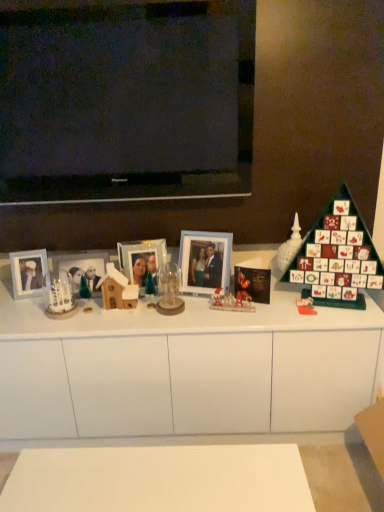
The width and height of the screenshot is (384, 512). I want to click on free space between green matte advent calendar at right and translucent plastic figurines at center, placed as the third toy when sorted from right to left, so click(276, 307).